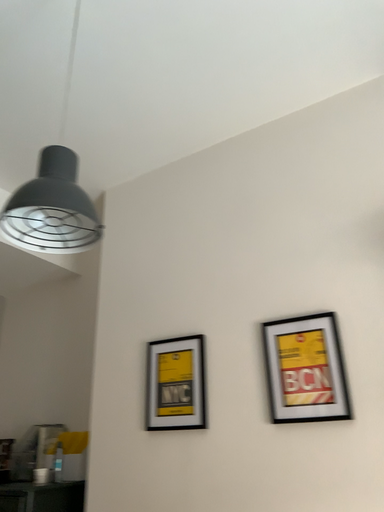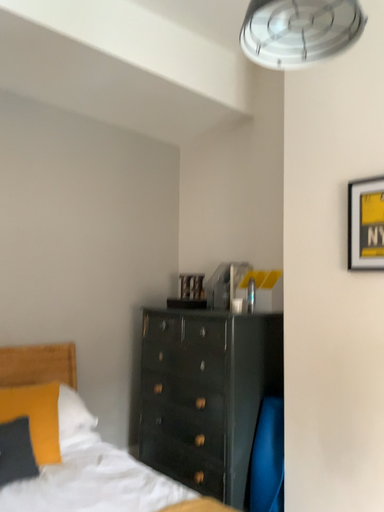
Question: Which way did the camera rotate in the video?

Choices:
 (A) rotated downward
 (B) rotated upward

Answer: (A)